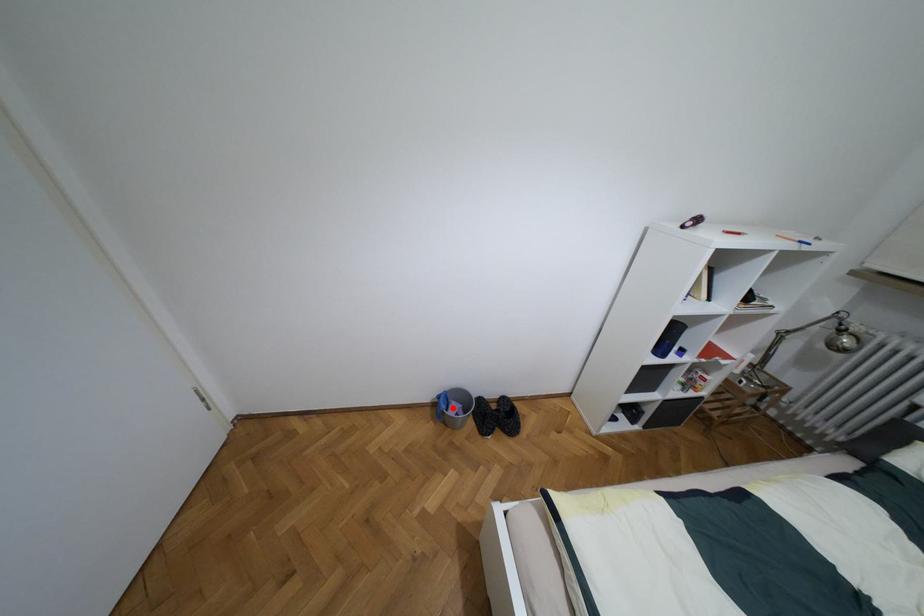
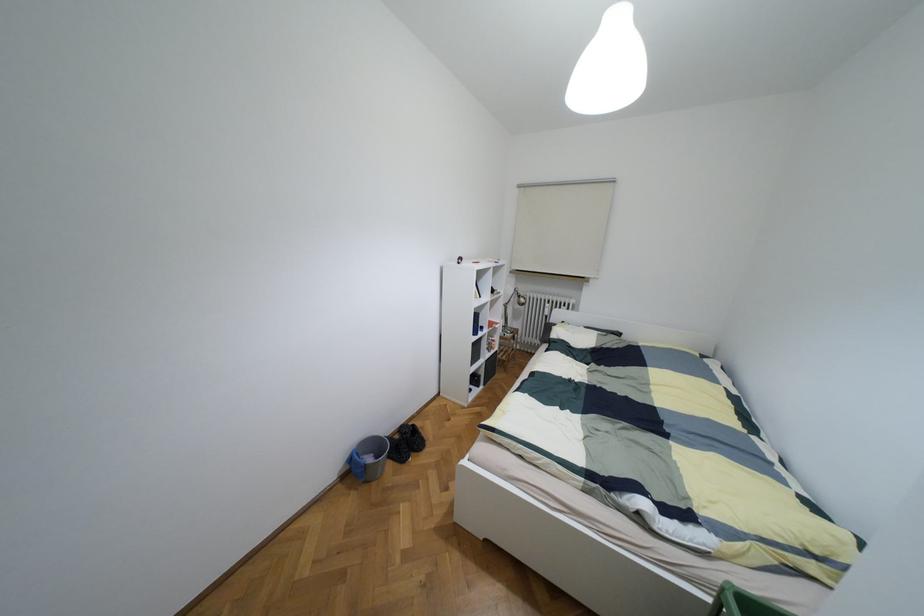
Locate, in the second image, the point that corresponds to the highlighted location in the first image.

(369, 459)